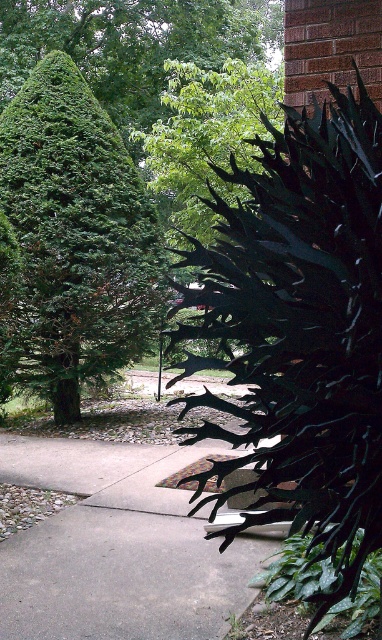
Question: Which object appears farthest from the camera in this image?

Choices:
 (A) gray concrete pavement at center
 (B) green matte bush at right
 (C) green leafy tree at left

Answer: (C)

Question: Does green matte bush at right appear under gray concrete pavement at center?

Choices:
 (A) no
 (B) yes

Answer: (A)

Question: Can you confirm if green matte bush at right is bigger than gray concrete pavement at center?

Choices:
 (A) no
 (B) yes

Answer: (B)

Question: Among these objects, which one is nearest to the camera?

Choices:
 (A) gray concrete pavement at center
 (B) green matte bush at right
 (C) green leafy tree at left

Answer: (B)

Question: Which of the following is the closest to the observer?

Choices:
 (A) green matte bush at right
 (B) gray concrete pavement at center

Answer: (A)

Question: Does green matte bush at right appear on the left side of gray concrete pavement at center?

Choices:
 (A) yes
 (B) no

Answer: (B)